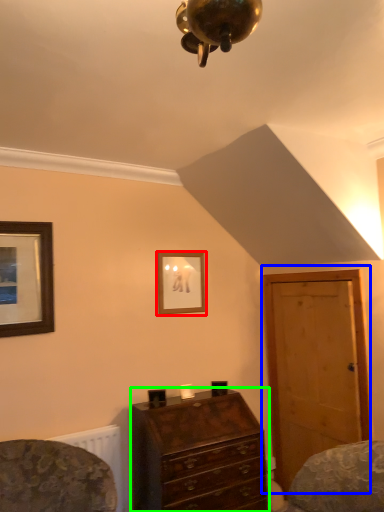
Question: Based on their relative distances, which object is nearer to picture frame (highlighted by a red box)? Choose from door (highlighted by a blue box) and chest of drawers (highlighted by a green box).

Choices:
 (A) door
 (B) chest of drawers

Answer: (A)